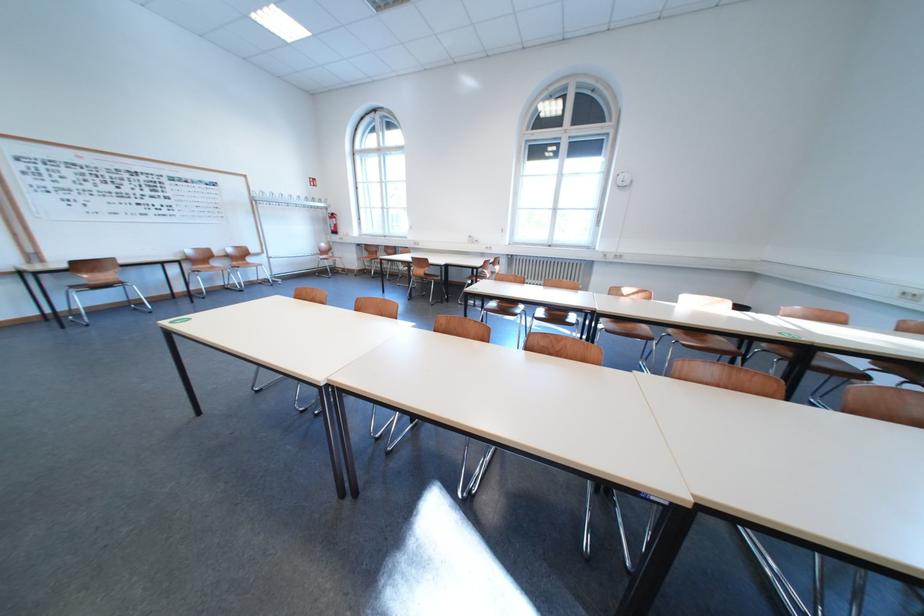
This screenshot has height=616, width=924. What do you see at coordinates (623, 179) in the screenshot? I see `the white coat hook` at bounding box center [623, 179].